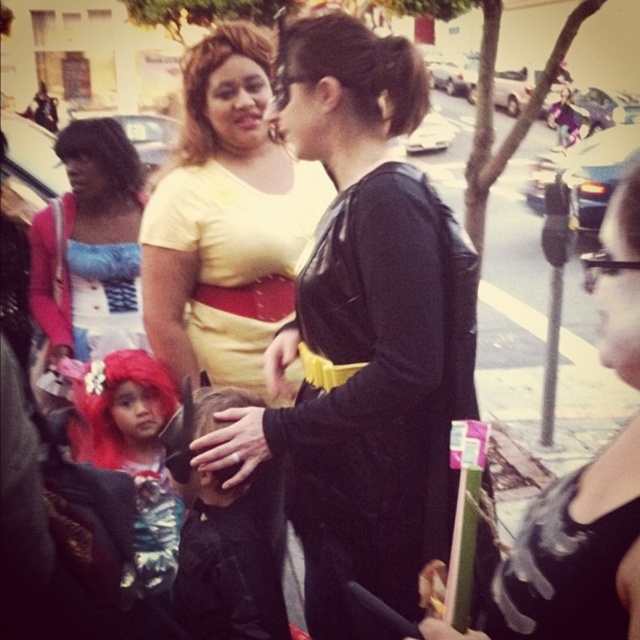
Does black leather jacket at center have a lesser width compared to black leather purse at center?

No, black leather jacket at center is not thinner than black leather purse at center.

What do you see at coordinates (364, 333) in the screenshot?
I see `black leather jacket at center` at bounding box center [364, 333].

Where is `black leather jacket at center`? Image resolution: width=640 pixels, height=640 pixels. black leather jacket at center is located at coordinates (364, 333).

Can you confirm if yellow matte dress at center is shorter than black leather purse at center?

No.

Can you confirm if yellow matte dress at center is bigger than black leather purse at center?

Yes, yellow matte dress at center is bigger than black leather purse at center.

Is point (240, 100) farther from viewer compared to point (602, 598)?

Yes, point (240, 100) is farther from viewer.

The image size is (640, 640). What are the coordinates of `yellow matte dress at center` in the screenshot? It's located at (225, 220).

Does black leather purse at center have a smaller size compared to matte blue dress at left?

Indeed, black leather purse at center has a smaller size compared to matte blue dress at left.

Looking at this image, how far apart are black leather purse at center and matte blue dress at left?

black leather purse at center and matte blue dress at left are 6.98 feet apart.

Which is in front, point (621, 618) or point (74, 349)?

Point (621, 618) is in front.

Where is `black leather purse at center`? Image resolution: width=640 pixels, height=640 pixels. black leather purse at center is located at coordinates (572, 557).